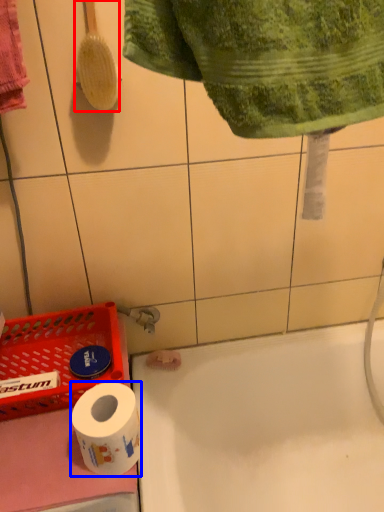
Question: Among these objects, which one is farthest to the camera, brush (highlighted by a red box) or toilet paper (highlighted by a blue box)?

Choices:
 (A) brush
 (B) toilet paper

Answer: (A)